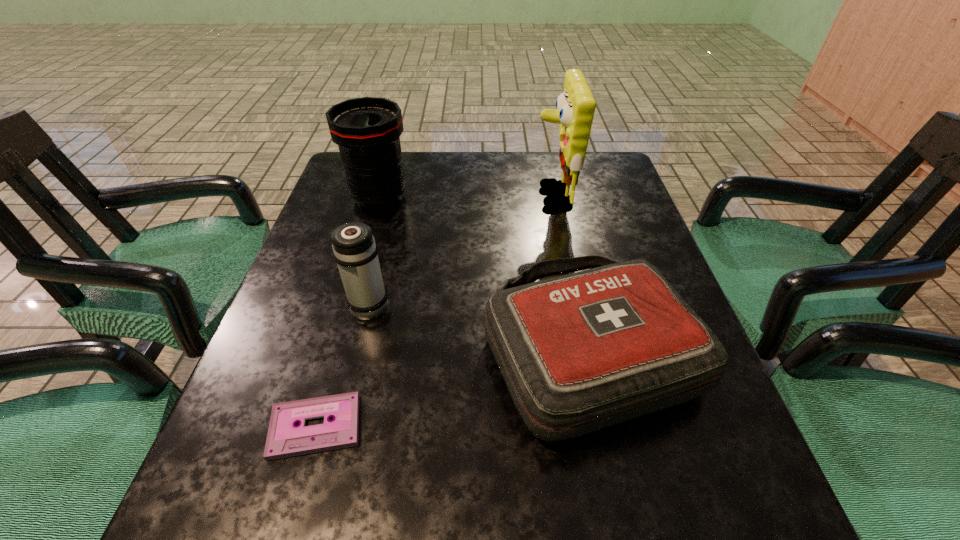
I want to click on unoccupied area between the shortest object and the fourth tallest object, so pyautogui.click(x=452, y=388).

In order to click on unoccupied area between the sponge and the first-aid kit in this screenshot , I will do `click(570, 273)`.

Image resolution: width=960 pixels, height=540 pixels. I want to click on vacant region between the shortest object and the tallest object, so click(434, 312).

In order to click on free space between the tallest object and the thermos bottle in this screenshot , I will do `click(461, 249)`.

The width and height of the screenshot is (960, 540). Find the location of `vacant space that's between the thermos bottle and the fourth tallest object`. vacant space that's between the thermos bottle and the fourth tallest object is located at coordinates pyautogui.click(x=479, y=327).

Where is `free space that is in between the fourth shortest object and the shortest object`? free space that is in between the fourth shortest object and the shortest object is located at coordinates (348, 312).

At what (x,y) coordinates should I click in order to perform the action: click on free spot between the sponge and the fourth tallest object. Please return your answer as a coordinate pair (x, y). Looking at the image, I should click on (570, 273).

Identify the location of blank region between the first-aid kit and the fourth shortest object. (484, 274).

Locate an element on the screen. free space between the third tallest object and the first-aid kit is located at coordinates (479, 327).

Locate an element on the screen. The width and height of the screenshot is (960, 540). the third closest object to the telephoto lens is located at coordinates (575, 106).